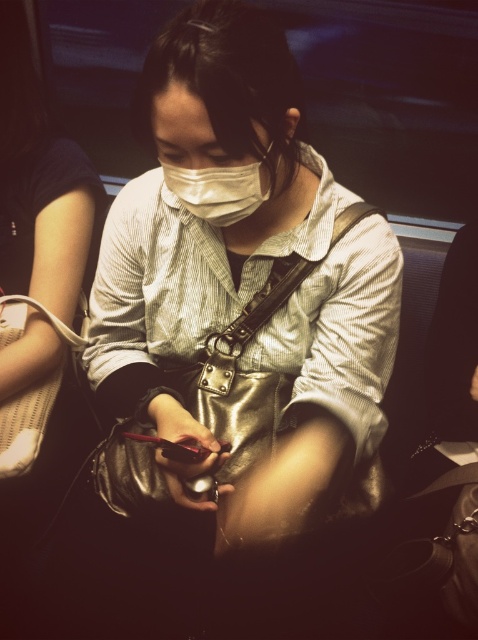
At what (x,y) coordinates should I click in order to perform the action: click on metallic purse at center. Please return your answer as a coordinate pair (x, y). Image resolution: width=478 pixels, height=640 pixels. Looking at the image, I should click on (239, 292).

I want to click on metallic purse at center, so click(239, 292).

The width and height of the screenshot is (478, 640). I want to click on metallic purse at center, so click(239, 292).